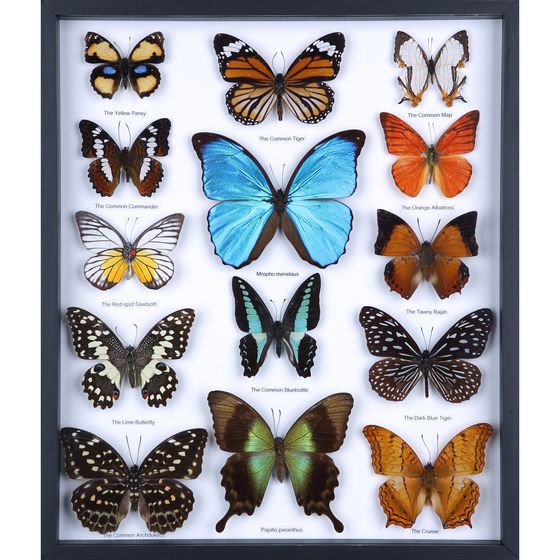
I want to click on corner, so click(x=44, y=1), click(x=60, y=17), click(x=514, y=6), click(x=501, y=15), click(x=502, y=542), click(x=514, y=554), click(x=62, y=539), click(x=41, y=554).